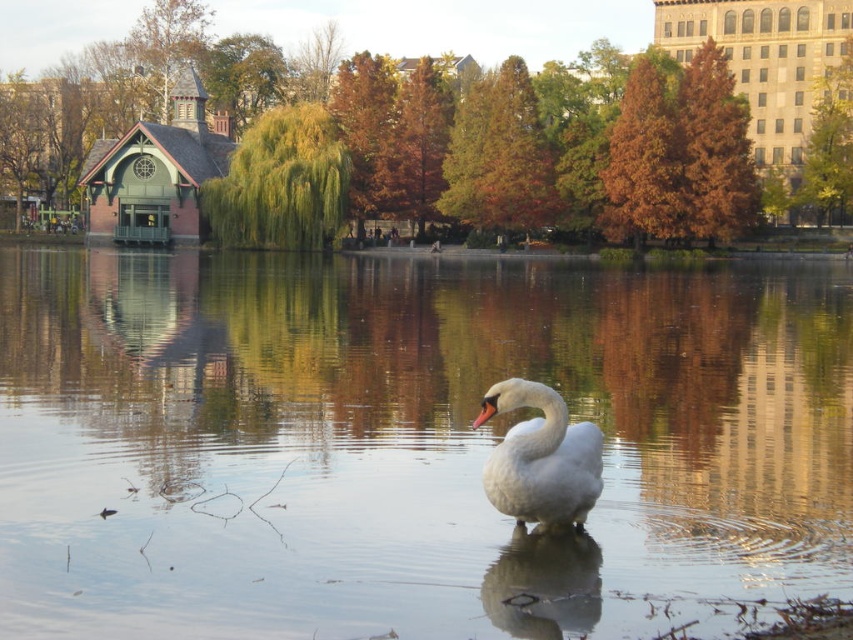
Based on the photo, you are designing a model of the park scene. The clear water at center and the white glossy swan at center must be placed in the model. Which object should be wider in the model to maintain accuracy?

The clear water at center should be wider than the white glossy swan at center in the model to maintain accuracy, as the description states that the clear water at center has a larger width compared to the white glossy swan at center.

You are standing in the park and want to take a photo of both the swan and the small building with the green roof. You notice two points marked in the image at coordinates point (4, 525) and point (572, 483). Which point should you stand closer to in order to ensure both the swan and the building are in frame?

You should stand closer to point (4, 525) because it is closer to the camera, allowing you to capture both the swan in the foreground and the building in the midground within the same frame.

You are a photographer wanting to capture the white glossy swan at center and the clear water at center in a single shot. Can you position yourself so that the swan is visible above the water?

The clear water at center is located above the white glossy swan at center, so positioning yourself to have the swan above the water would not be possible as the water is positioned above the swan in the scene.